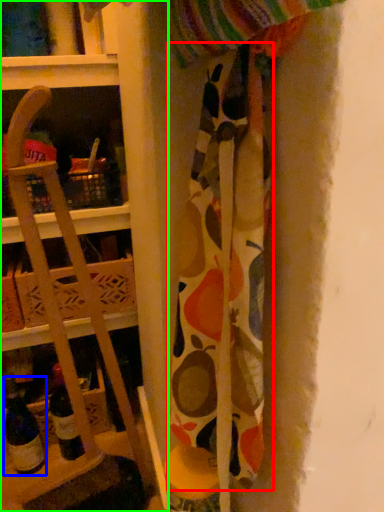
Question: Which object is the closest to the fabric (highlighted by a red box)? Choose among these: wine bottle (highlighted by a blue box) or shelf (highlighted by a green box).

Choices:
 (A) wine bottle
 (B) shelf

Answer: (B)